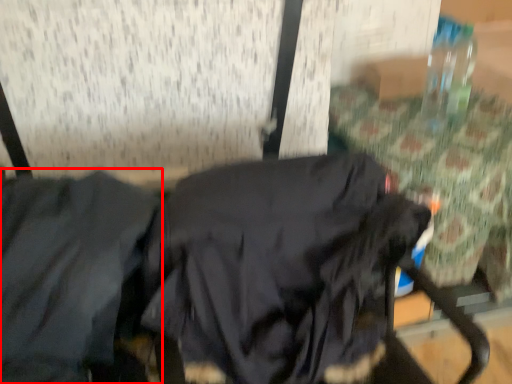
Question: From the image, what is the correct spatial relationship of jacket (annotated by the red box) in relation to sweatshirt?

Choices:
 (A) left
 (B) right

Answer: (A)